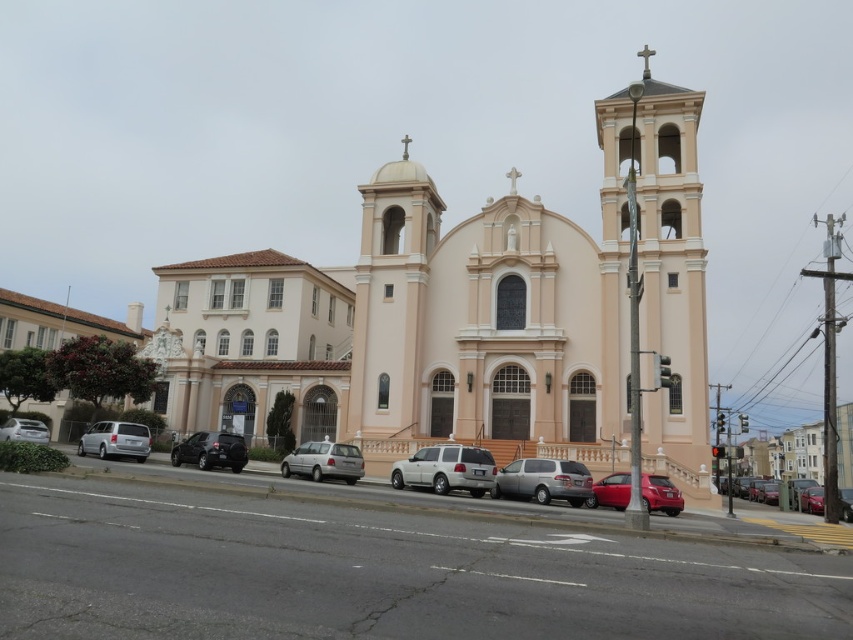
Question: Does metallic red car at lower right have a lesser width compared to satin silver minivan at left?

Choices:
 (A) yes
 (B) no

Answer: (A)

Question: Which of the following is the farthest from the observer?

Choices:
 (A) white matte suv at center
 (B) silver metallic van at center

Answer: (B)

Question: In this image, where is silver metallic van at center located relative to metallic silver sedan at center?

Choices:
 (A) above
 (B) below

Answer: (A)

Question: Which is farther from the shiny black sedan at lower left?

Choices:
 (A) metallic silver sedan at center
 (B) silver metallic sedan at lower left

Answer: (A)

Question: Which point is closer to the camera?

Choices:
 (A) shiny black sedan at lower left
 (B) silver metallic van at center
 (C) silver metallic sedan at lower left
 (D) pink stucco church at center

Answer: (D)

Question: Can you confirm if satin silver minivan at center is wider than silver metallic van at center?

Choices:
 (A) yes
 (B) no

Answer: (B)